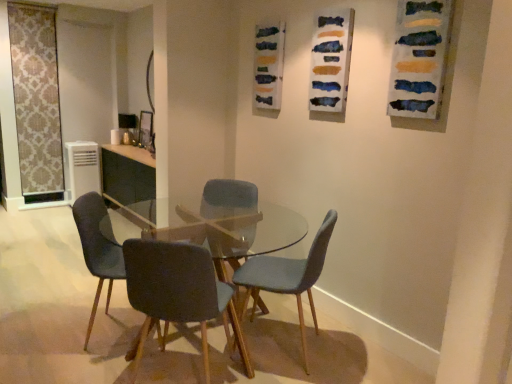
How much space does velvet dark blue chair at center, acting as the 1th chair starting from the left, occupy horizontally?

velvet dark blue chair at center, acting as the 1th chair starting from the left, is 22.30 inches in width.

What do you see at coordinates (331, 60) in the screenshot?
I see `watercolor paint at upper center` at bounding box center [331, 60].

Describe the element at coordinates (178, 292) in the screenshot. I see `dark gray fabric chair at center, acting as the 3th chair starting from the right` at that location.

What do you see at coordinates (81, 169) in the screenshot? The height and width of the screenshot is (384, 512). I see `white plastic air conditioner at left` at bounding box center [81, 169].

Find the location of `velvet dark blue chair at center, which is the 4th chair in right-to-left order`. velvet dark blue chair at center, which is the 4th chair in right-to-left order is located at coordinates (98, 247).

Can you see beige damask fabric at left touching white plastic air conditioner at left?

No, beige damask fabric at left is not making contact with white plastic air conditioner at left.

Can you confirm if beige damask fabric at left is positioned to the left of white plastic air conditioner at left?

Yes, beige damask fabric at left is to the left of white plastic air conditioner at left.

How many degrees apart are the facing directions of beige damask fabric at left and white plastic air conditioner at left?

There is a 3.72-degree angle between the facing directions of beige damask fabric at left and white plastic air conditioner at left.

Can you confirm if beige damask fabric at left is thinner than white plastic air conditioner at left?

Indeed, beige damask fabric at left has a lesser width compared to white plastic air conditioner at left.

Locate an element on the screen. appliance behind the velvet dark blue chair at center, acting as the 1th chair starting from the left is located at coordinates (81, 169).

Is velvet dark blue chair at center, which is the 4th chair in right-to-left order, positioned far away from white plastic air conditioner at left?

Yes, velvet dark blue chair at center, which is the 4th chair in right-to-left order, and white plastic air conditioner at left are quite far apart.

From a real-world perspective, is velvet dark blue chair at center, acting as the 1th chair starting from the left, positioned above or below white plastic air conditioner at left?

velvet dark blue chair at center, acting as the 1th chair starting from the left, is above white plastic air conditioner at left.

From the image's perspective, is velvet dark blue chair at center, acting as the 1th chair starting from the left, beneath white plastic air conditioner at left?

Yes, from the image's perspective, velvet dark blue chair at center, acting as the 1th chair starting from the left, is beneath white plastic air conditioner at left.

Looking at this image, from a real-world perspective, which object stands above the other?

dark gray fabric chair at center, acting as the 3th chair starting from the right.

Can you confirm if dark gray fabric chair at center, which appears as the 2th chair when viewed from the left, is positioned to the right of matte blue fabric chair at center, which is the 1th chair from right to left?

In fact, dark gray fabric chair at center, which appears as the 2th chair when viewed from the left, is to the left of matte blue fabric chair at center, which is the 1th chair from right to left.

Does dark gray fabric chair at center, acting as the 3th chair starting from the right, turn towards matte blue fabric chair at center, which is the 1th chair from right to left?

No.

Which of these two, dark gray fabric chair at center, which appears as the 2th chair when viewed from the left, or matte blue fabric chair at center, which is the 1th chair from right to left, is wider?

Wider between the two is dark gray fabric chair at center, which appears as the 2th chair when viewed from the left.

From a real-world perspective, does watercolor paint at upper center stand above clear glass table at center?

Yes.

Is clear glass table at center located within watercolor paint at upper center?

No, clear glass table at center is not inside watercolor paint at upper center.

Can you tell me how much watercolor paint at upper center and clear glass table at center differ in facing direction?

There is a 0.55-degree angle between the facing directions of watercolor paint at upper center and clear glass table at center.

Considering the sizes of objects watercolor paint at upper center and clear glass table at center in the image provided, who is thinner, watercolor paint at upper center or clear glass table at center?

watercolor paint at upper center is thinner.

Is velvet blue chair at center, which ranks as the 2th chair in right-to-left order, smaller than beige damask fabric at left?

No, velvet blue chair at center, which ranks as the 2th chair in right-to-left order, is not smaller than beige damask fabric at left.

From a real-world perspective, is velvet blue chair at center, which ranks as the 2th chair in right-to-left order, over beige damask fabric at left?

No, from a real-world perspective, velvet blue chair at center, which ranks as the 2th chair in right-to-left order, is not above beige damask fabric at left.

Which object is further away from the camera taking this photo, velvet blue chair at center, the 3th chair in the left-to-right sequence, or beige damask fabric at left?

beige damask fabric at left is more distant.

Measure the distance between velvet blue chair at center, the 3th chair in the left-to-right sequence, and beige damask fabric at left.

11.86 feet.

Which point is more forward, (138, 265) or (36, 115)?

Point (138, 265)

Is dark gray fabric chair at center, acting as the 3th chair starting from the right, to the left or to the right of beige damask fabric at left in the image?

Based on their positions, dark gray fabric chair at center, acting as the 3th chair starting from the right, is located to the right of beige damask fabric at left.

From a real-world perspective, is dark gray fabric chair at center, acting as the 3th chair starting from the right, located beneath beige damask fabric at left?

Yes.

Considering the relative positions of dark gray fabric chair at center, acting as the 3th chair starting from the right, and beige damask fabric at left in the image provided, is dark gray fabric chair at center, acting as the 3th chair starting from the right, in front of beige damask fabric at left?

Yes, dark gray fabric chair at center, acting as the 3th chair starting from the right, is closer to the viewer.

Consider the image. Can you confirm if clear glass table at center is wider than velvet dark blue chair at center, acting as the 1th chair starting from the left?

Yes.

From the image's perspective, relative to velvet dark blue chair at center, acting as the 1th chair starting from the left, is clear glass table at center above or below?

clear glass table at center is situated lower than velvet dark blue chair at center, acting as the 1th chair starting from the left, in the image.

Is clear glass table at center oriented towards velvet dark blue chair at center, acting as the 1th chair starting from the left?

Yes, clear glass table at center is facing velvet dark blue chair at center, acting as the 1th chair starting from the left.

Is clear glass table at center next to velvet dark blue chair at center, acting as the 1th chair starting from the left?

No.

Where is `appliance below the beige damask fabric at left (from a real-world perspective)`? appliance below the beige damask fabric at left (from a real-world perspective) is located at coordinates (81, 169).

Where is `appliance behind the velvet dark blue chair at center, acting as the 1th chair starting from the left`? appliance behind the velvet dark blue chair at center, acting as the 1th chair starting from the left is located at coordinates (81, 169).

When comparing their distances from clear glass table at center, does beige damask fabric at left or watercolor paint at upper center seem further?

beige damask fabric at left is positioned further to the anchor clear glass table at center.

In the scene shown: Based on their spatial positions, is white plastic air conditioner at left or clear glass table at center closer to matte blue fabric chair at center, which is the 1th chair from right to left?

clear glass table at center is closer to matte blue fabric chair at center, which is the 1th chair from right to left.

Considering their positions, is watercolor paint at upper center positioned closer to velvet blue chair at center, which ranks as the 2th chair in right-to-left order, than velvet dark blue chair at center, acting as the 1th chair starting from the left?

Among the two, velvet dark blue chair at center, acting as the 1th chair starting from the left, is located nearer to velvet blue chair at center, which ranks as the 2th chair in right-to-left order.

Estimate the real-world distances between objects in this image. Which object is further from white plastic air conditioner at left, matte blue fabric chair at center, which is the 1th chair from right to left, or clear glass table at center?

matte blue fabric chair at center, which is the 1th chair from right to left.

When comparing their distances from clear glass table at center, does beige damask fabric at left or velvet blue chair at center, the 3th chair in the left-to-right sequence, seem further?

Based on the image, beige damask fabric at left appears to be further to clear glass table at center.

When comparing their distances from velvet blue chair at center, which ranks as the 2th chair in right-to-left order, does dark gray fabric chair at center, acting as the 3th chair starting from the right, or beige damask fabric at left seem closer?

dark gray fabric chair at center, acting as the 3th chair starting from the right.

Considering their positions, is beige damask fabric at left positioned further to clear glass table at center than white plastic air conditioner at left?

beige damask fabric at left.

Which object lies nearer to the anchor point matte blue fabric chair at center, which appears as the 4th chair when viewed from the left, clear glass table at center or dark gray fabric chair at center, which appears as the 2th chair when viewed from the left?

clear glass table at center is closer to matte blue fabric chair at center, which appears as the 4th chair when viewed from the left.

You are a GUI agent. You are given a task and a screenshot of the screen. Output one action in this format:
    pyautogui.click(x=<x>, y=<y>)
    Task: Click on the screen door between dark gray fabric chair at center, acting as the 3th chair starting from the right, and white plastic air conditioner at left in the front-back direction
    The image size is (512, 384).
    Given the screenshot: What is the action you would take?
    pyautogui.click(x=36, y=100)

Where is `chair between velvet dark blue chair at center, which is the 4th chair in right-to-left order, and beige damask fabric at left from front to back`? chair between velvet dark blue chair at center, which is the 4th chair in right-to-left order, and beige damask fabric at left from front to back is located at coordinates (228, 198).

Image resolution: width=512 pixels, height=384 pixels. Find the location of `appliance between beige damask fabric at left and watercolor paint at upper center in the horizontal direction`. appliance between beige damask fabric at left and watercolor paint at upper center in the horizontal direction is located at coordinates (81, 169).

The width and height of the screenshot is (512, 384). What are the coordinates of `kitchen & dining room table between watercolor paint at upper center and dark gray fabric chair at center, which appears as the 2th chair when viewed from the left, in the up-down direction` in the screenshot? It's located at (152, 236).